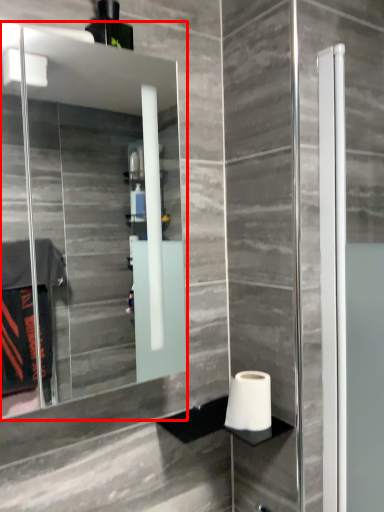
Question: From the image's perspective, considering the relative positions of mirror (annotated by the red box) and toilet paper in the image provided, where is mirror (annotated by the red box) located with respect to the staircase?

Choices:
 (A) above
 (B) below

Answer: (A)